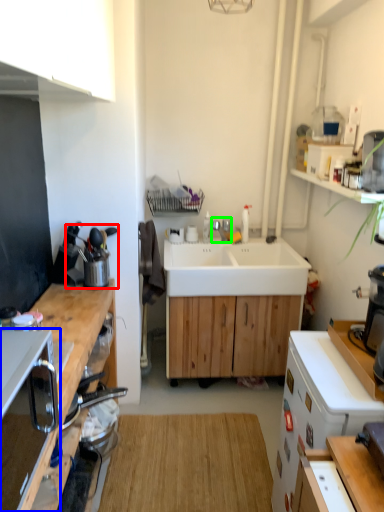
Question: Estimate the real-world distances between objects in this image. Which object is closer to appliance (highlighted by a red box), corded phone (highlighted by a blue box) or tap (highlighted by a green box)?

Choices:
 (A) corded phone
 (B) tap

Answer: (B)